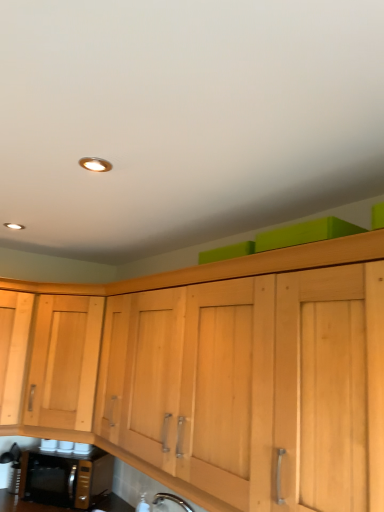
This screenshot has width=384, height=512. What do you see at coordinates (66, 478) in the screenshot?
I see `black metallic microwave oven at lower left` at bounding box center [66, 478].

The image size is (384, 512). Identify the location of black metallic microwave oven at lower left. (66, 478).

I want to click on light wood cabinet at left, so click(64, 362).

What do you see at coordinates (64, 362) in the screenshot? The image size is (384, 512). I see `light wood cabinet at left` at bounding box center [64, 362].

Identify the location of black metallic microwave oven at lower left. Image resolution: width=384 pixels, height=512 pixels. (66, 478).

Which object is positioned more to the left, black metallic microwave oven at lower left or light wood cabinet at left?

black metallic microwave oven at lower left.

Which object is further away from the camera, black metallic microwave oven at lower left or light wood cabinet at left?

black metallic microwave oven at lower left is behind.

Is point (44, 479) positioned behind point (66, 298)?

No, it is not.

From the image's perspective, is black metallic microwave oven at lower left on light wood cabinet at left?

Result: Actually, black metallic microwave oven at lower left appears below light wood cabinet at left in the image.

From a real-world perspective, which object rests below the other?

In real-world perspective, black metallic microwave oven at lower left is lower.

Which object is thinner, black metallic microwave oven at lower left or light wood cabinet at left?

black metallic microwave oven at lower left is thinner.

Considering the relative sizes of black metallic microwave oven at lower left and light wood cabinet at left in the image provided, is black metallic microwave oven at lower left shorter than light wood cabinet at left?

Yes, black metallic microwave oven at lower left is shorter than light wood cabinet at left.

Looking at the image, does black metallic microwave oven at lower left seem bigger or smaller compared to light wood cabinet at left?

black metallic microwave oven at lower left is smaller than light wood cabinet at left.

Would you say black metallic microwave oven at lower left is outside light wood cabinet at left?

black metallic microwave oven at lower left is positioned outside light wood cabinet at left.

Is black metallic microwave oven at lower left with light wood cabinet at left?

No, black metallic microwave oven at lower left is not beside light wood cabinet at left.

Is black metallic microwave oven at lower left aimed at light wood cabinet at left?

No.

Measure the distance between black metallic microwave oven at lower left and light wood cabinet at left.

The distance of black metallic microwave oven at lower left from light wood cabinet at left is 41.80 centimeters.

Locate an element on the screen. cabinetry in front of the black metallic microwave oven at lower left is located at coordinates coord(64,362).

Is light wood cabinet at left to the left of black metallic microwave oven at lower left from the viewer's perspective?

Incorrect, light wood cabinet at left is not on the left side of black metallic microwave oven at lower left.

In the scene shown: Is light wood cabinet at left closer to camera compared to black metallic microwave oven at lower left?

Yes.

Considering the positions of point (79, 351) and point (50, 474), is point (79, 351) closer or farther from the camera than point (50, 474)?

Point (79, 351) is positioned farther from the camera compared to point (50, 474).

In the scene shown: From the image's perspective, does light wood cabinet at left appear lower than black metallic microwave oven at lower left?

No, from the image's perspective, light wood cabinet at left is not below black metallic microwave oven at lower left.

From a real-world perspective, which is physically above, light wood cabinet at left or black metallic microwave oven at lower left?

light wood cabinet at left.

Considering the relative sizes of light wood cabinet at left and black metallic microwave oven at lower left in the image provided, is light wood cabinet at left wider than black metallic microwave oven at lower left?

Yes.

Is light wood cabinet at left taller than black metallic microwave oven at lower left?

Yes, light wood cabinet at left is taller than black metallic microwave oven at lower left.

Is light wood cabinet at left smaller than black metallic microwave oven at lower left?

No, light wood cabinet at left is not smaller than black metallic microwave oven at lower left.

Is light wood cabinet at left not within black metallic microwave oven at lower left?

Absolutely, light wood cabinet at left is external to black metallic microwave oven at lower left.

Is there a large distance between light wood cabinet at left and black metallic microwave oven at lower left?

light wood cabinet at left is near black metallic microwave oven at lower left, not far away.

Is light wood cabinet at left facing towards black metallic microwave oven at lower left?

No, light wood cabinet at left is not facing towards black metallic microwave oven at lower left.

Locate an element on the screen. The width and height of the screenshot is (384, 512). cabinetry lying above the black metallic microwave oven at lower left (from the image's perspective) is located at coordinates (64, 362).

This screenshot has height=512, width=384. What are the coordinates of `cabinetry that appears on the right of black metallic microwave oven at lower left` in the screenshot? It's located at (64, 362).

Find the location of `microwave oven below the light wood cabinet at left (from the image's perspective)`. microwave oven below the light wood cabinet at left (from the image's perspective) is located at coordinates (66, 478).